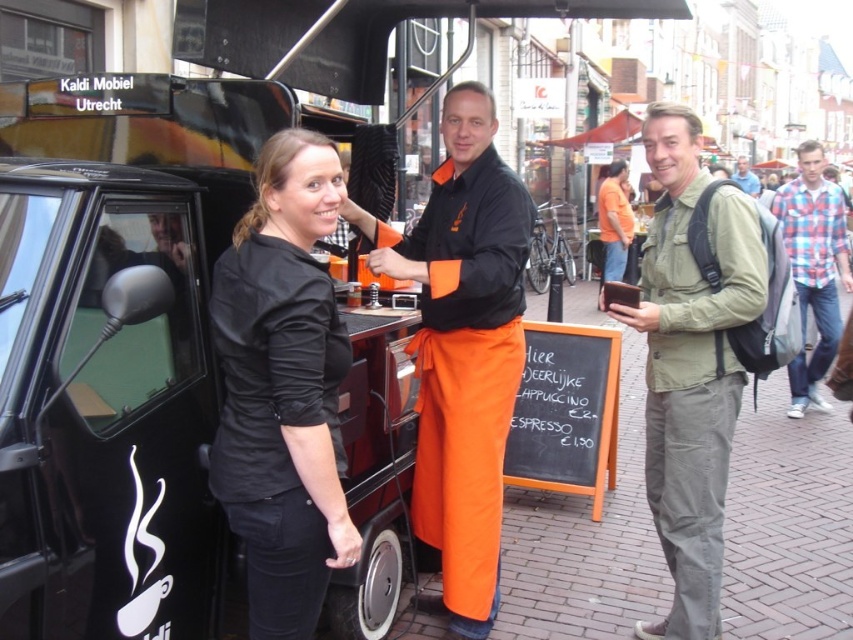
Question: Is orange fabric apron at center wider than black chalkboard at center?

Choices:
 (A) yes
 (B) no

Answer: (A)

Question: Which object is closer to the camera taking this photo?

Choices:
 (A) black matte van at left
 (B) black chalkboard at center

Answer: (A)

Question: Does khaki fabric jacket at center have a larger size compared to plaid cotton shirt at right?

Choices:
 (A) no
 (B) yes

Answer: (A)

Question: Which object is positioned closest to the blue denim jacket at upper right?

Choices:
 (A) khaki fabric jacket at center
 (B) black matte van at left
 (C) black matte shirt at left

Answer: (A)

Question: Is the position of black matte shirt at left less distant than that of blue denim jacket at upper right?

Choices:
 (A) yes
 (B) no

Answer: (A)

Question: Which of the following is the closest to the observer?

Choices:
 (A) black chalkboard at center
 (B) black matte shirt at left
 (C) blue denim jacket at upper right
 (D) black matte van at left

Answer: (D)